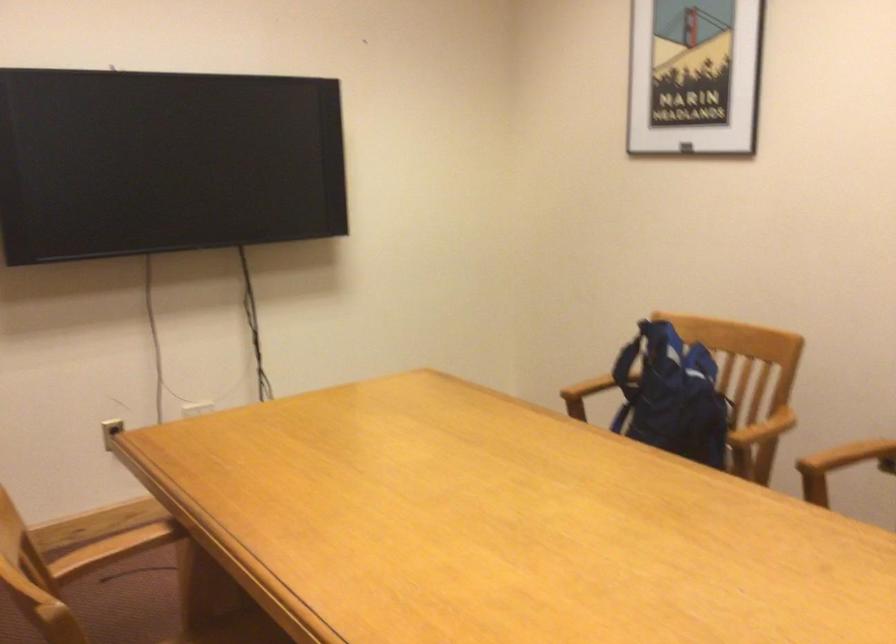
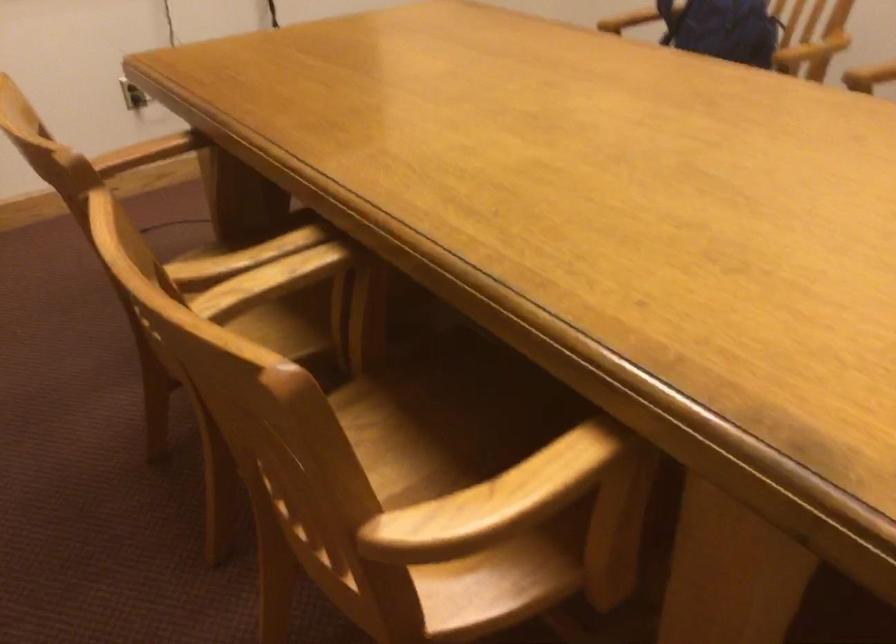
The images are taken continuously from a first-person perspective. In which direction are you moving?

The cameraman moved toward left, forward.